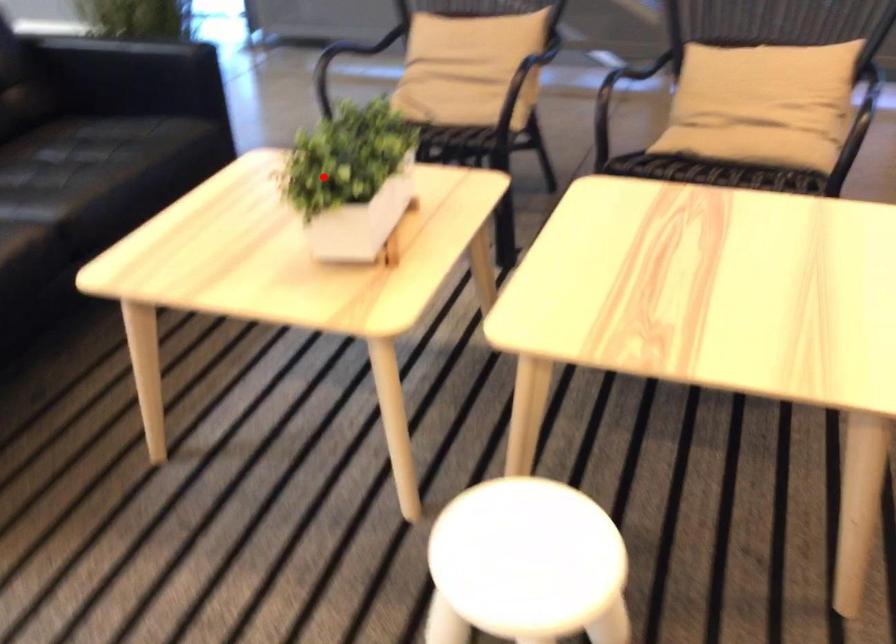
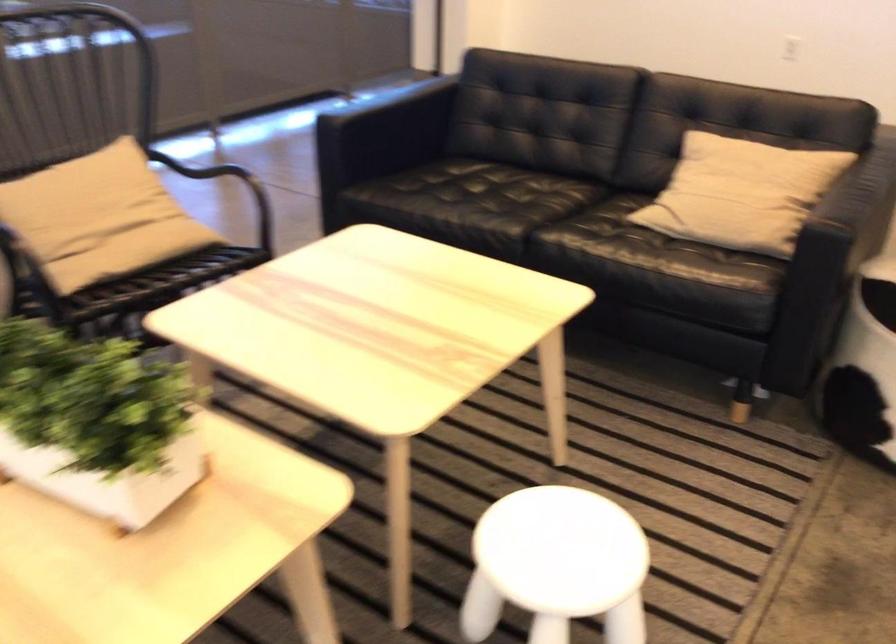
Locate, in the second image, the point that corresponds to the highlighted location in the first image.

(96, 422)